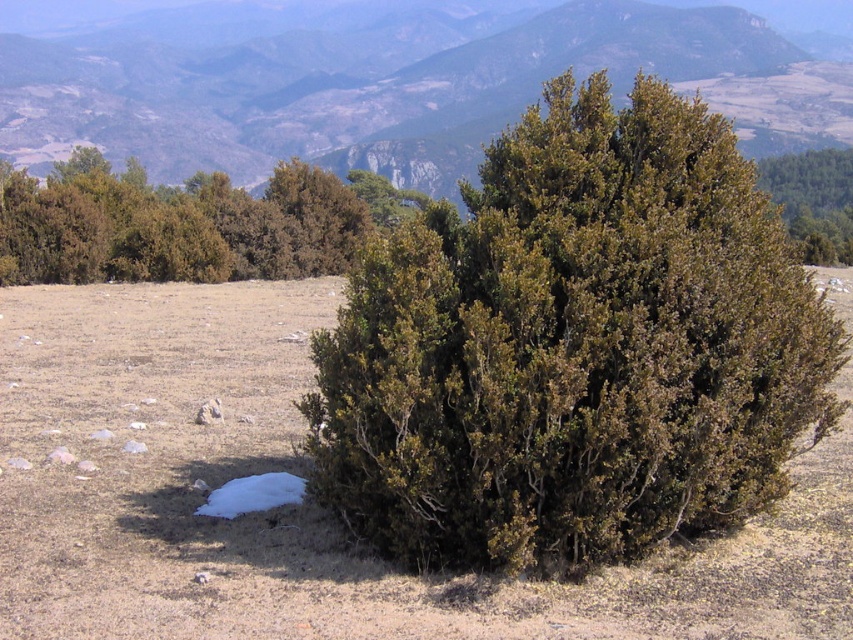
Question: Which object appears closest to the camera in this image?

Choices:
 (A) brown dry grass at center
 (B) green leafy bush at upper center

Answer: (A)

Question: Which of these objects is positioned farthest from the green leafy shrub at center?

Choices:
 (A) green leafy bush at upper center
 (B) green leafy bush at center
 (C) green leafy bush at upper left
 (D) brown dry grass at center

Answer: (B)

Question: Can you confirm if brown dry grass at center is positioned below green leafy bush at center?

Choices:
 (A) yes
 (B) no

Answer: (A)

Question: Is brown dry grass at center behind green leafy bush at upper center?

Choices:
 (A) yes
 (B) no

Answer: (B)

Question: Does green leafy shrub at center have a lesser width compared to green leafy bush at upper left?

Choices:
 (A) yes
 (B) no

Answer: (B)

Question: Which object appears farthest from the camera in this image?

Choices:
 (A) green leafy bush at upper left
 (B) green leafy bush at center

Answer: (B)